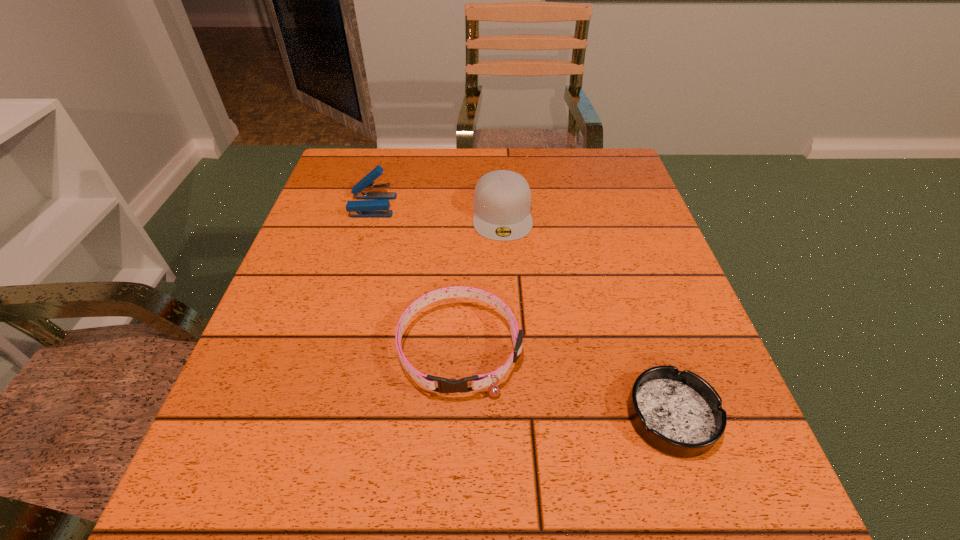
Identify the location of stapler located in the far edge section of the desktop. (360, 208).

This screenshot has height=540, width=960. I want to click on object that is at the left edge, so click(360, 208).

This screenshot has height=540, width=960. I want to click on object that is at the right edge, so click(x=679, y=413).

You are a GUI agent. You are given a task and a screenshot of the screen. Output one action in this format:
    pyautogui.click(x=<x>, y=<y>)
    Task: Click on the object present at the far left corner
    
    Given the screenshot: What is the action you would take?
    pyautogui.click(x=360, y=208)

In the image, there is a desktop. At what (x,y) coordinates should I click in order to perform the action: click on vacant space at the far edge. Please return your answer as a coordinate pair (x, y). This screenshot has width=960, height=540. Looking at the image, I should click on (492, 156).

The image size is (960, 540). I want to click on vacant space at the near edge of the desktop, so click(x=455, y=499).

Find the location of a particular element. vacant area at the left edge is located at coordinates (368, 255).

At what (x,y) coordinates should I click in order to perform the action: click on free point at the right edge. Please return your answer as a coordinate pair (x, y). The image size is (960, 540). Looking at the image, I should click on (695, 350).

In the image, there is a desktop. At what (x,y) coordinates should I click in order to perform the action: click on free region at the far left corner. Please return your answer as a coordinate pair (x, y). The image size is (960, 540). Looking at the image, I should click on (348, 157).

Locate an element on the screen. This screenshot has height=540, width=960. vacant region at the near left corner of the desktop is located at coordinates (295, 523).